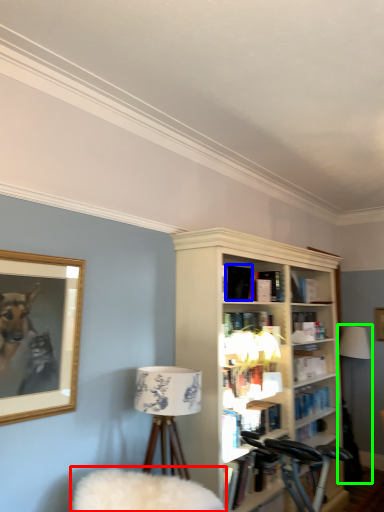
Question: Considering the real-world distances, which object is farthest from swivel chair (highlighted by a red box)? book (highlighted by a blue box) or table lamp (highlighted by a green box)?

Choices:
 (A) book
 (B) table lamp

Answer: (B)